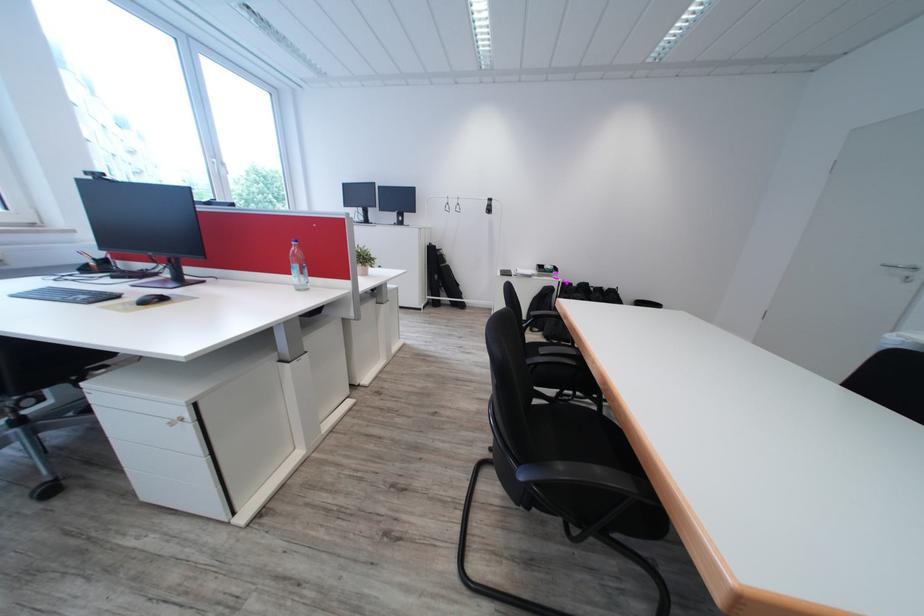
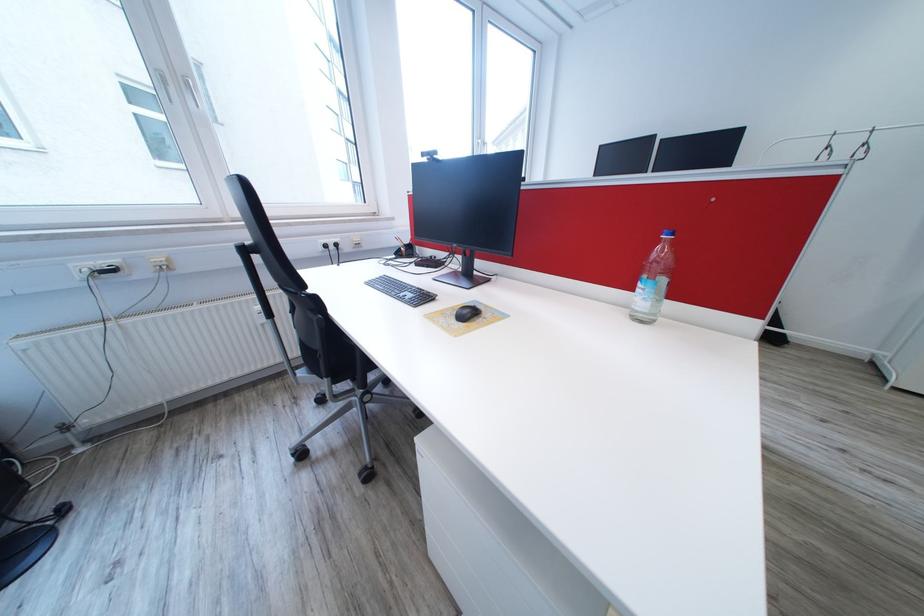
In the second image, find the point that corresponds to point (136, 305) in the first image.

(454, 315)